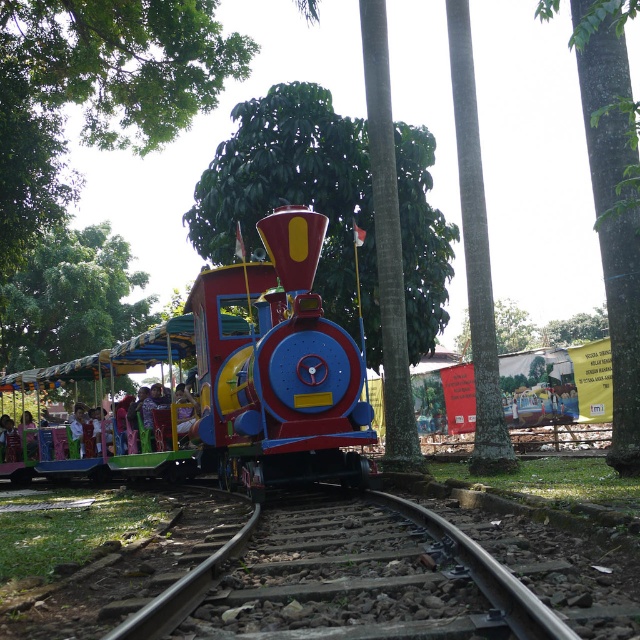
You are a parent waiting at the edge of the scene. You see the brown gravel train track at center and the green textured tree trunk at center. Which object is closer to you?

The brown gravel train track at center is closer to the viewer than the green textured tree trunk at center.

You are a parent trying to decide whether to let your child play near the brown gravel train track at center and the green rough bark tree at center. Based on their positions, which object is closer to the ground?

The brown gravel train track at center is below the green rough bark tree at center, so the train track is closer to the ground.

You are a parent trying to find shade for your child in the amusement park. You see the green leafy tree at upper center. Is the tree located closer to the top or bottom of the image?

The green leafy tree at upper center is located at point 0.153 on the vertical axis, which places it closer to the bottom of the image since the coordinates are measured from the bottom left corner.